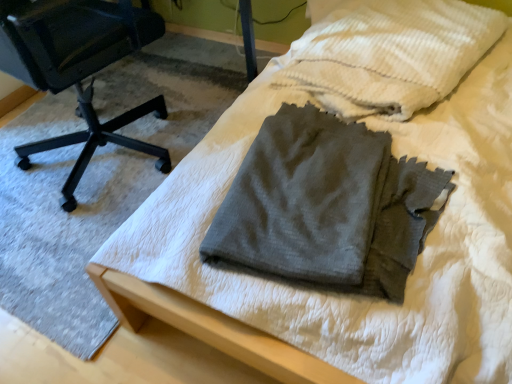
Question: Should I look upward or downward to see dark gray cotton pants at center?

Choices:
 (A) up
 (B) down

Answer: (A)

Question: Are gray cotton towel at center and dark gray cotton pants at center making contact?

Choices:
 (A) no
 (B) yes

Answer: (A)

Question: Does gray cotton towel at center come behind dark gray cotton pants at center?

Choices:
 (A) no
 (B) yes

Answer: (B)

Question: Is there a large distance between gray cotton towel at center and dark gray cotton pants at center?

Choices:
 (A) yes
 (B) no

Answer: (B)

Question: Is gray cotton towel at center bigger than dark gray cotton pants at center?

Choices:
 (A) no
 (B) yes

Answer: (B)

Question: Can you confirm if gray cotton towel at center is positioned to the right of dark gray cotton pants at center?

Choices:
 (A) yes
 (B) no

Answer: (A)

Question: Could you tell me if gray cotton towel at center is facing dark gray cotton pants at center?

Choices:
 (A) yes
 (B) no

Answer: (B)

Question: Would you say dark gray cotton pants at center is part of black plastic chair at left's contents?

Choices:
 (A) yes
 (B) no

Answer: (B)

Question: Is black plastic chair at left positioned far away from dark gray cotton pants at center?

Choices:
 (A) no
 (B) yes

Answer: (A)

Question: Does black plastic chair at left turn towards dark gray cotton pants at center?

Choices:
 (A) yes
 (B) no

Answer: (B)

Question: Can you confirm if black plastic chair at left is shorter than dark gray cotton pants at center?

Choices:
 (A) no
 (B) yes

Answer: (A)

Question: Is black plastic chair at left next to dark gray cotton pants at center and touching it?

Choices:
 (A) yes
 (B) no

Answer: (B)

Question: From a real-world perspective, is black plastic chair at left located beneath dark gray cotton pants at center?

Choices:
 (A) no
 (B) yes

Answer: (A)

Question: Can you confirm if dark gray cotton pants at center is shorter than gray cotton towel at center?

Choices:
 (A) yes
 (B) no

Answer: (A)